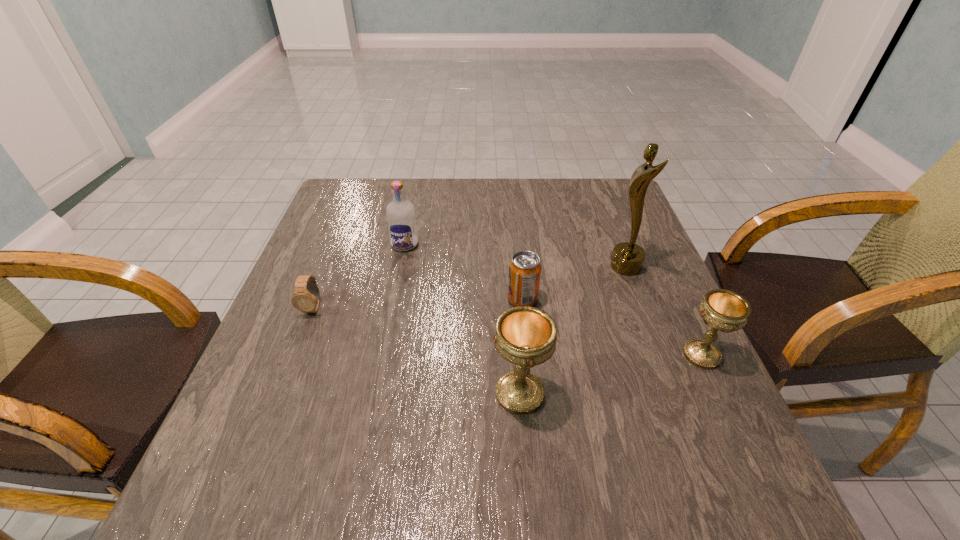
I want to click on free region located 0.270m on the back of the third shortest object, so click(657, 258).

At what (x,y) coordinates should I click in order to perform the action: click on vacant space located 0.180m on the label of the second object from left to right. Please return your answer as a coordinate pair (x, y). Looking at the image, I should click on (393, 302).

Identify the location of vacant space located on the front-facing side of the tallest object. (551, 267).

This screenshot has width=960, height=540. What are the coordinates of `vacant space located 0.350m on the front-facing side of the tallest object` in the screenshot? It's located at (472, 267).

Identify the location of vacant space located 0.320m on the front-facing side of the tallest object. This screenshot has width=960, height=540. (484, 267).

Find the location of a particular element. vacant position located 0.200m on the left of the soda can is located at coordinates (421, 299).

Where is `free space located on the face of the shortest object`? This screenshot has height=540, width=960. free space located on the face of the shortest object is located at coordinates (272, 415).

The image size is (960, 540). What are the coordinates of `object that is at the near edge` in the screenshot? It's located at (526, 336).

Locate an element on the screen. The width and height of the screenshot is (960, 540). object located at the left edge is located at coordinates (306, 298).

I want to click on chalice that is at the right edge, so click(724, 310).